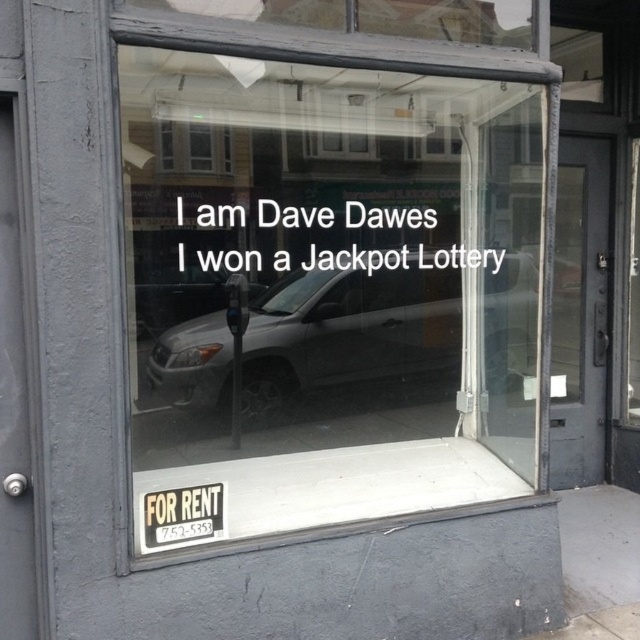
Does transparent glass sign at center have a smaller size compared to metallic gray parking meter at center?

No, transparent glass sign at center is not smaller than metallic gray parking meter at center.

Between transparent glass sign at center and metallic gray parking meter at center, which one has more height?

transparent glass sign at center is taller.

What do you see at coordinates (326, 291) in the screenshot? I see `transparent glass sign at center` at bounding box center [326, 291].

Identify the location of transparent glass sign at center. The width and height of the screenshot is (640, 640). (326, 291).

Is point (484, 465) closer to camera compared to point (273, 348)?

Yes, point (484, 465) is closer to viewer.

Is transparent glass sign at center closer to the viewer compared to gray matte suv at center?

Yes.

Where is `transparent glass sign at center`? This screenshot has height=640, width=640. transparent glass sign at center is located at coordinates (326, 291).

You are a GUI agent. You are given a task and a screenshot of the screen. Output one action in this format:
    pyautogui.click(x=<x>, y=<y>)
    Task: Click on the white paper text at center
    This screenshot has width=640, height=640.
    Given the screenshot: What is the action you would take?
    pyautogui.click(x=388, y=216)

Is white paper text at center smaller than metallic gray parking meter at center?

No.

Find the location of `white paper text at center`. white paper text at center is located at coordinates (388, 216).